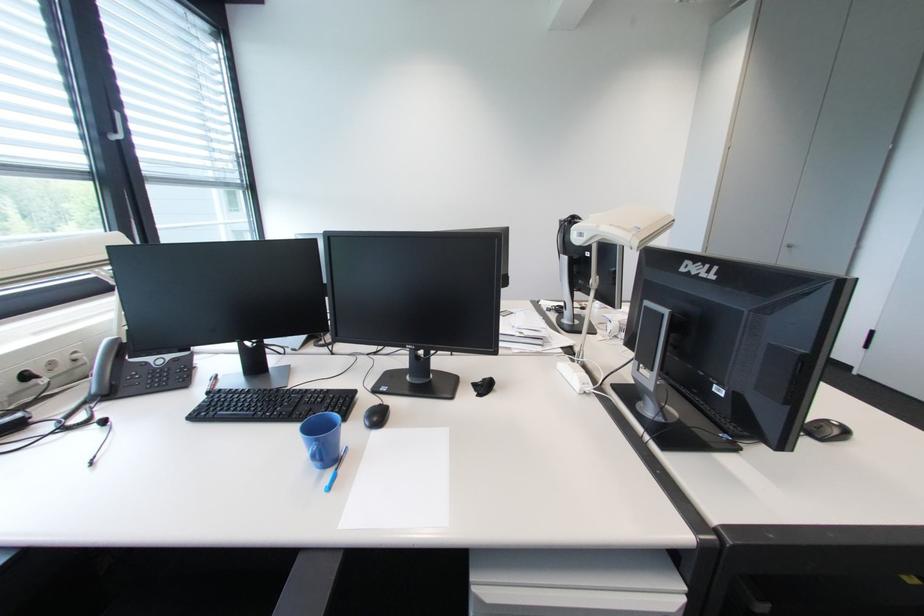
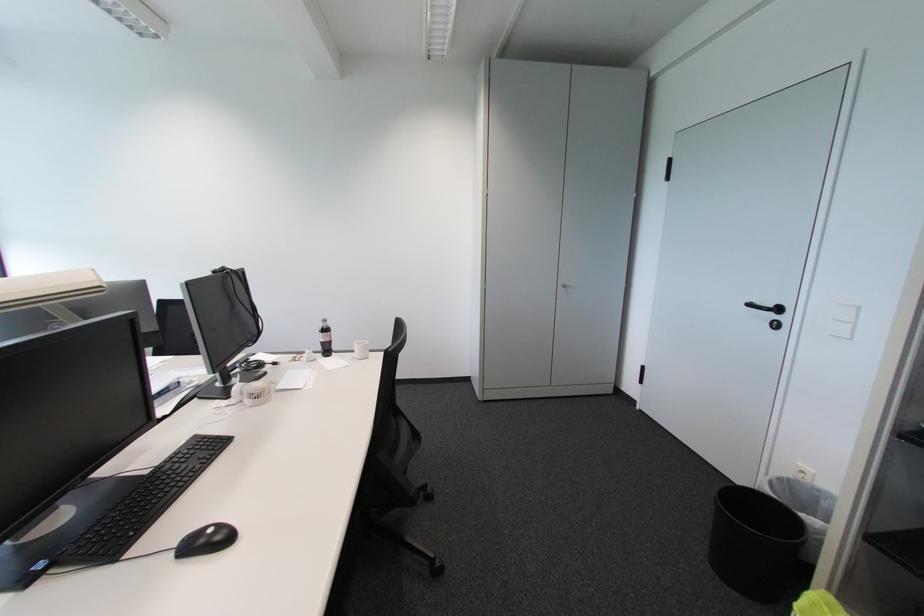
Question: In a continuous first-person perspective shot, in which direction is the camera moving?

Choices:
 (A) Left
 (B) Right
 (C) Forward
 (D) Backward

Answer: (B)